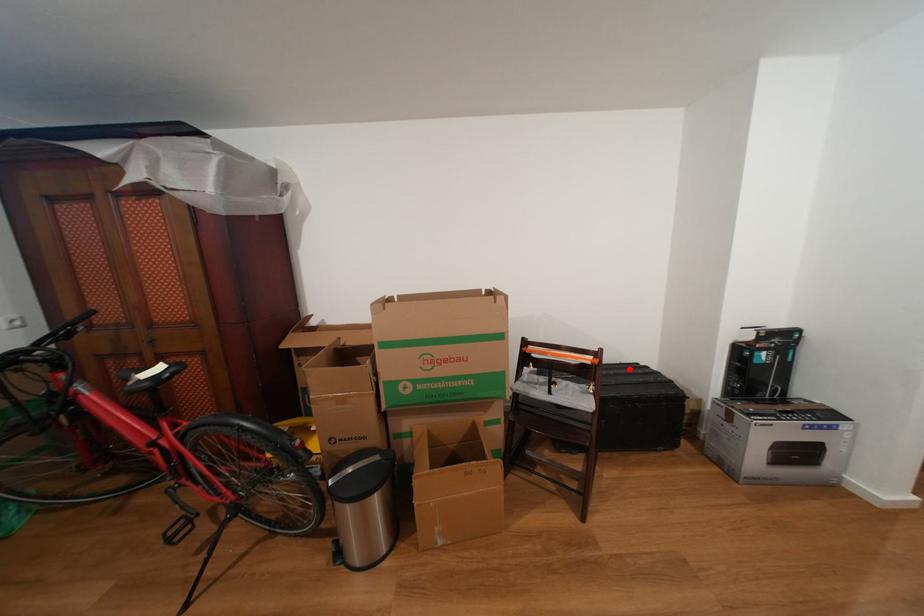
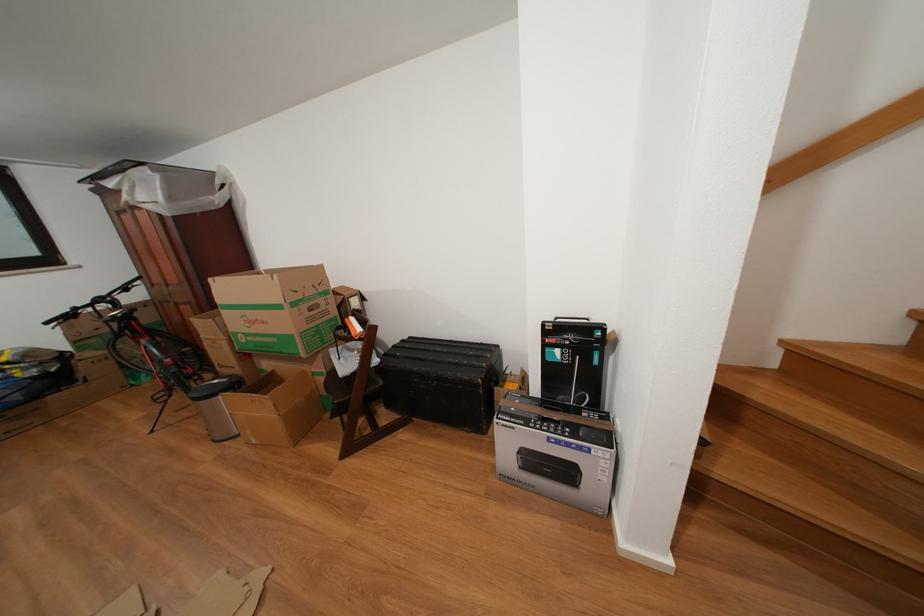
Question: I am providing you with two images of the same scene from different viewpoints. In image1, a red point is highlighted. Considering the same 3D point in image2, which of the following is correct?

Choices:
 (A) It is closer
 (B) It is farther

Answer: (A)